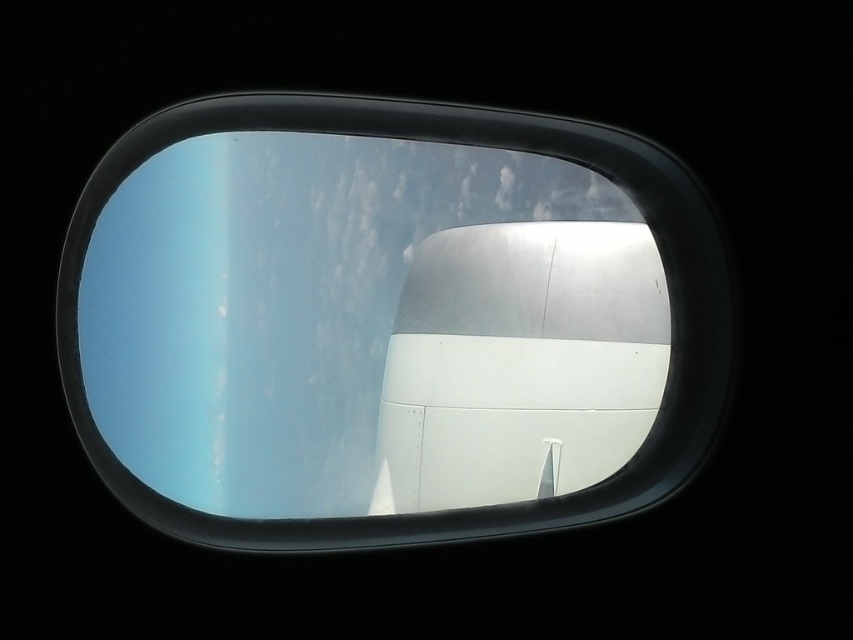
The height and width of the screenshot is (640, 853). Find the location of `transparent glass airplane window at center`. transparent glass airplane window at center is located at coordinates (387, 323).

Who is more distant from viewer, [90,218] or [431,424]?

The point [431,424] is behind.

The image size is (853, 640). Identify the location of transparent glass airplane window at center. (387, 323).

Where is `transparent glass airplane window at center`? transparent glass airplane window at center is located at coordinates (387, 323).